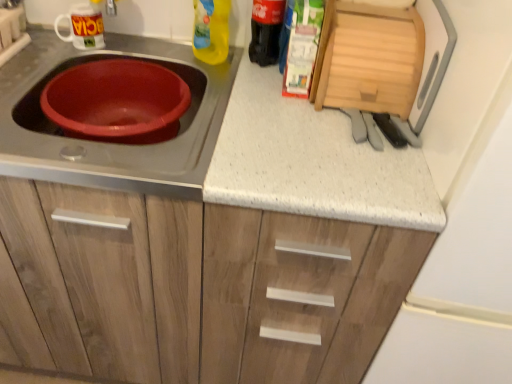
Question: Does point (51, 147) appear closer or farther from the camera than point (86, 39)?

Choices:
 (A) closer
 (B) farther

Answer: (A)

Question: From a real-world perspective, is white speckled laminate at center positioned above or below white glossy mug at upper left, placed as the first appliance when sorted from left to right?

Choices:
 (A) below
 (B) above

Answer: (A)

Question: Based on their relative distances, which object is nearer to the yellow plastic bottle at upper center, the 1th bottle viewed from the left?

Choices:
 (A) black glass bottle at upper right, positioned as the 1th bottle in right-to-left order
 (B) white speckled laminate at center
 (C) white glossy mug at upper left, the second appliance in the right-to-left sequence
 (D) wooden cutting board at upper right, the second appliance from the left
 (E) matte plastic basin at left

Answer: (A)

Question: Which is nearer to the wooden cutting board at upper right, the second appliance from the left?

Choices:
 (A) black glass bottle at upper right, which appears as the 2th bottle when viewed from the left
 (B) white speckled laminate at center
 (C) matte plastic basin at left
 (D) yellow plastic bottle at upper center, which is the 2th bottle in right-to-left order
 (E) white glossy mug at upper left, the second appliance in the right-to-left sequence

Answer: (B)